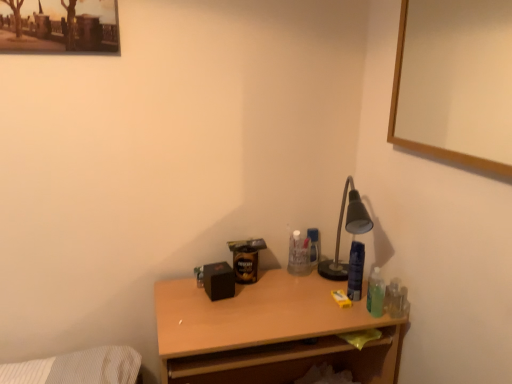
Question: Is wooden desk at center wider or thinner than wooden picture frame at upper right?

Choices:
 (A) wide
 (B) thin

Answer: (A)

Question: Is wooden desk at center bigger or smaller than wooden picture frame at upper right?

Choices:
 (A) small
 (B) big

Answer: (B)

Question: Considering the positions of point (321, 327) and point (493, 76), is point (321, 327) closer or farther from the camera than point (493, 76)?

Choices:
 (A) farther
 (B) closer

Answer: (B)

Question: From a real-world perspective, is wooden picture frame at upper right positioned above or below wooden desk at center?

Choices:
 (A) above
 (B) below

Answer: (A)

Question: Is wooden picture frame at upper right spatially inside wooden desk at center, or outside of it?

Choices:
 (A) inside
 (B) outside

Answer: (B)

Question: Considering the positions of wooden picture frame at upper right and wooden desk at center in the image, is wooden picture frame at upper right taller or shorter than wooden desk at center?

Choices:
 (A) tall
 (B) short

Answer: (B)

Question: From the image's perspective, relative to wooden desk at center, is wooden picture frame at upper right above or below?

Choices:
 (A) above
 (B) below

Answer: (A)